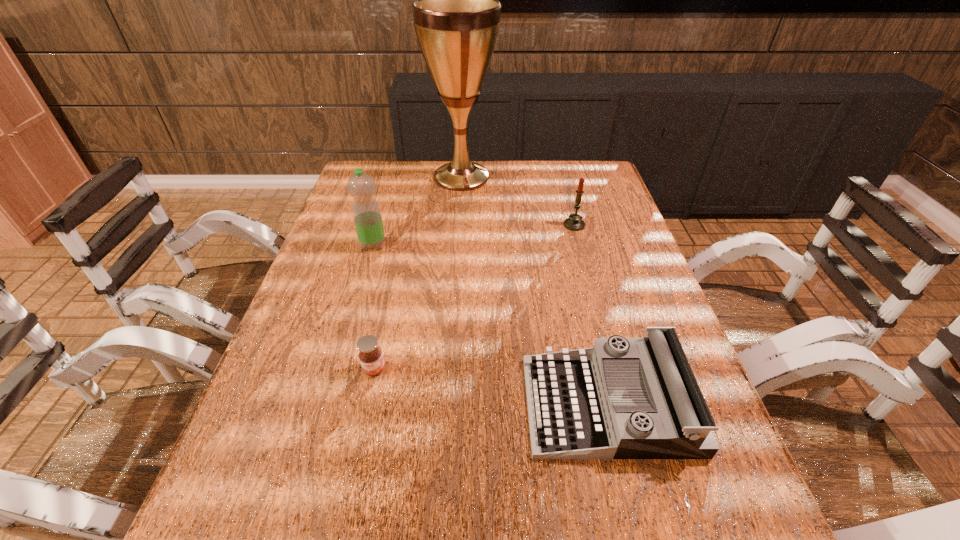
Locate an element on the screen. The image size is (960, 540). free space located on the back of the leftmost object is located at coordinates (386, 200).

I want to click on free space located on the right of the third tallest object, so click(605, 225).

Locate an element on the screen. The width and height of the screenshot is (960, 540). vacant space located on the typing side of the fourth tallest object is located at coordinates (497, 405).

Locate an element on the screen. This screenshot has height=540, width=960. free space located 0.290m on the typing side of the fourth tallest object is located at coordinates (382, 405).

This screenshot has height=540, width=960. I want to click on vacant space located on the typing side of the fourth tallest object, so click(x=362, y=405).

At what (x,y) coordinates should I click in order to perform the action: click on vacant space located 0.180m on the label side of the shortest object. Please return your answer as a coordinate pair (x, y). The height and width of the screenshot is (540, 960). Looking at the image, I should click on (354, 463).

Locate an element on the screen. This screenshot has width=960, height=540. object that is positioned at the far edge is located at coordinates (456, 15).

Where is `object positioned at the left edge`? The height and width of the screenshot is (540, 960). object positioned at the left edge is located at coordinates (367, 217).

You are a GUI agent. You are given a task and a screenshot of the screen. Output one action in this format:
    pyautogui.click(x=<x>, y=<y>)
    Task: Click on the candle that is at the right edge
    The image size is (960, 540).
    Given the screenshot: What is the action you would take?
    pyautogui.click(x=574, y=223)

Where is `typewriter present at the right edge`? The width and height of the screenshot is (960, 540). typewriter present at the right edge is located at coordinates (624, 398).